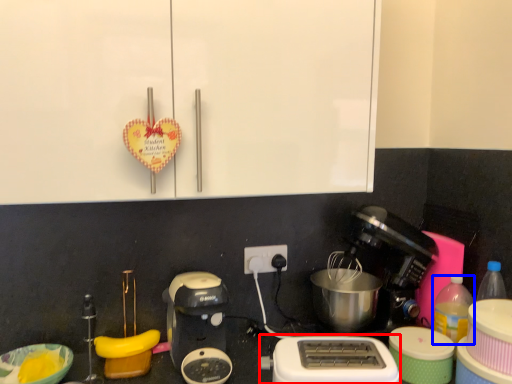
Question: Which object is further to the camera taking this photo, toaster (highlighted by a red box) or bottle (highlighted by a blue box)?

Choices:
 (A) toaster
 (B) bottle

Answer: (B)